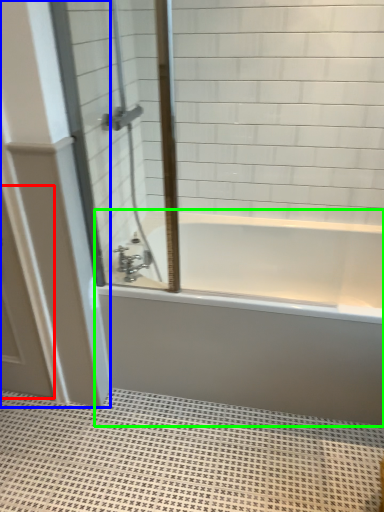
Question: Based on their relative distances, which object is farther from screen door (highlighted by a red box)? Choose from door (highlighted by a blue box) and bathtub (highlighted by a green box).

Choices:
 (A) door
 (B) bathtub

Answer: (B)